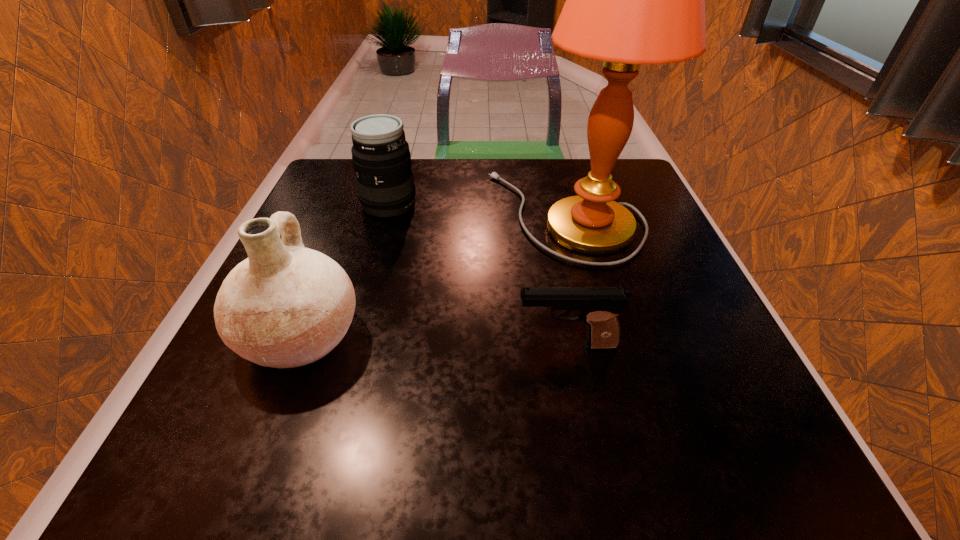
Locate an element on the screen. Image resolution: width=960 pixels, height=540 pixels. free region at the right edge of the desktop is located at coordinates (691, 323).

The image size is (960, 540). In the image, there is a desktop. In order to click on vacant space at the near right corner in this screenshot , I will do `click(742, 451)`.

Where is `free point between the pistol and the lamp`? free point between the pistol and the lamp is located at coordinates (566, 280).

Where is `vacant region between the shortest object and the pottery`? The width and height of the screenshot is (960, 540). vacant region between the shortest object and the pottery is located at coordinates (434, 341).

Image resolution: width=960 pixels, height=540 pixels. In order to click on free point between the pottery and the telephoto lens in this screenshot , I will do `click(345, 271)`.

Locate an element on the screen. The width and height of the screenshot is (960, 540). vacant area that lies between the pottery and the pistol is located at coordinates (434, 341).

You are a GUI agent. You are given a task and a screenshot of the screen. Output one action in this format:
    pyautogui.click(x=<x>, y=<y>)
    Task: Click on the vacant space that's between the lamp and the pistol
    Image resolution: width=960 pixels, height=540 pixels.
    Given the screenshot: What is the action you would take?
    pyautogui.click(x=566, y=280)

The image size is (960, 540). Identify the location of vacant region between the pottery and the telephoto lens. (345, 271).

You are a GUI agent. You are given a task and a screenshot of the screen. Output one action in this format:
    pyautogui.click(x=<x>, y=<y>)
    Task: Click on the free spot between the lamp and the pottery
    This screenshot has height=540, width=960.
    Given the screenshot: What is the action you would take?
    pyautogui.click(x=433, y=276)

Find the location of `empty location between the pistol and the pottery`. empty location between the pistol and the pottery is located at coordinates (434, 341).